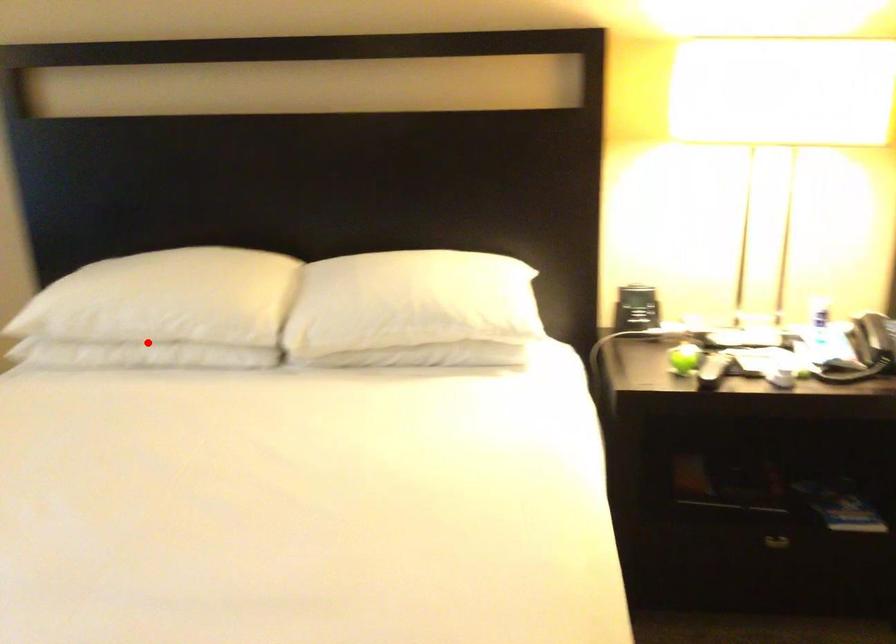
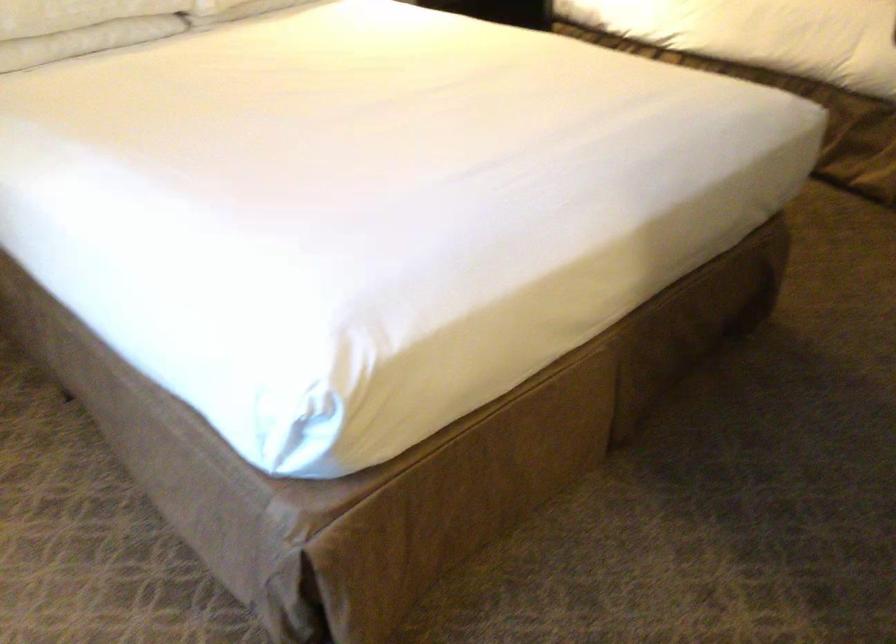
Where in the second image is the point corresponding to the highlighted location from the first image?

(81, 26)